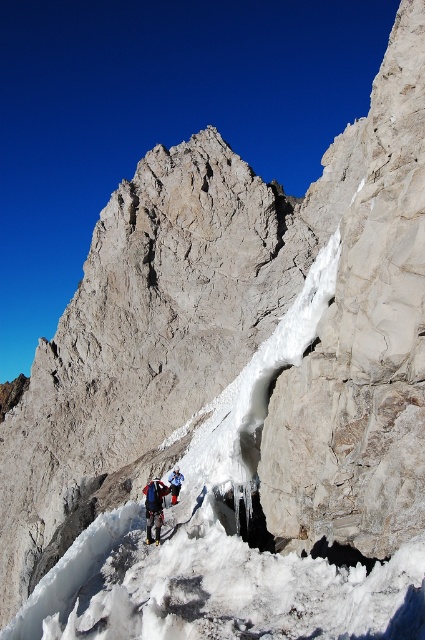
Identify the location of matte blue jacket at center. This screenshot has width=425, height=640. (153, 508).

Does matte blue jacket at center have a greater width compared to blue fabric jacket at lower center?

Yes.

Who is more distant from viewer, (x=161, y=509) or (x=170, y=476)?

The point (x=170, y=476) is behind.

In order to click on matte blue jacket at center in this screenshot , I will do `click(153, 508)`.